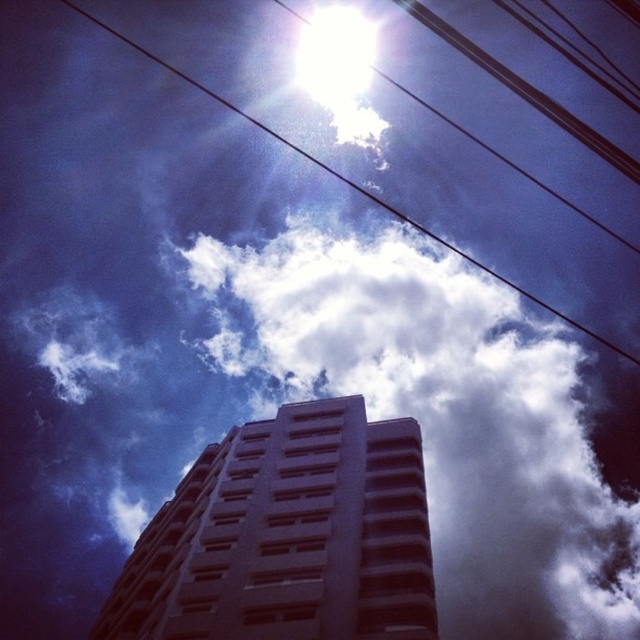
You are standing on the ground looking up at the tall building. You notice both the white fluffy cloud at upper center and the metallic wire at upper center in your view. Which object appears larger in the sky?

The metallic wire at upper center appears larger than the white fluffy cloud at upper center because the description states that the white fluffy cloud at upper center has a smaller size compared to the metallic wire at upper center.